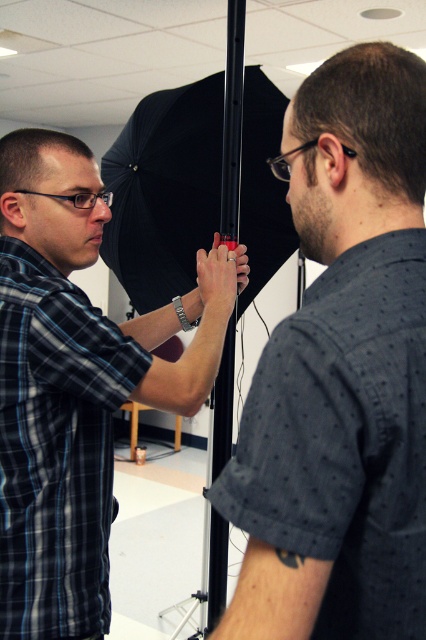
Question: Estimate the real-world distances between objects in this image. Which object is closer to the plaid shirt at left?

Choices:
 (A) black matte umbrella at center
 (B) black matte pole at center

Answer: (A)

Question: Which of the following is the farthest from the observer?

Choices:
 (A) (103, 529)
 (B) (293, 500)
 (C) (268, 192)

Answer: (C)

Question: Does plaid shirt at left have a greater width compared to black matte umbrella at center?

Choices:
 (A) no
 (B) yes

Answer: (A)

Question: Can you confirm if black matte pole at center is positioned to the left of black matte umbrella at center?

Choices:
 (A) yes
 (B) no

Answer: (B)

Question: Can you confirm if black matte pole at center is bigger than black matte umbrella at center?

Choices:
 (A) no
 (B) yes

Answer: (A)

Question: Which point appears closest to the camera in this image?

Choices:
 (A) (276, 422)
 (B) (86, 243)

Answer: (A)